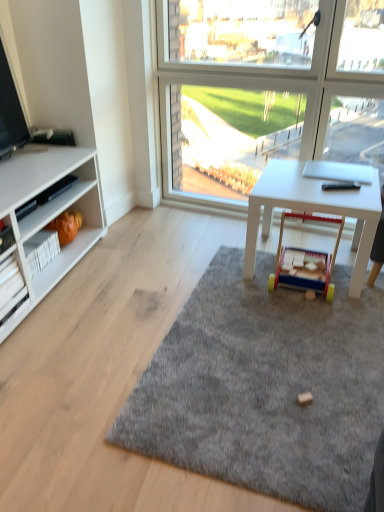
Question: From a real-world perspective, is orange fabric toy at lower left, the 1th toy viewed from the back, above or below white cardboard shelf at left?

Choices:
 (A) below
 (B) above

Answer: (A)

Question: Is orange fabric toy at lower left, the 1th toy viewed from the back, spatially inside white cardboard shelf at left, or outside of it?

Choices:
 (A) outside
 (B) inside

Answer: (A)

Question: Which object is positioned farthest from the white cardboard shelf at left?

Choices:
 (A) white matte desk at center
 (B) orange fabric toy at lower left, the 1th toy viewed from the back
 (C) wooden toy at center, acting as the second toy starting from the back
 (D) gray soft rug at center

Answer: (A)

Question: Estimate the real-world distances between objects in this image. Which object is closer to the orange fabric toy at lower left, the 2th toy in the right-to-left sequence?

Choices:
 (A) white matte desk at center
 (B) gray soft rug at center
 (C) wooden toy at center, which ranks as the first toy in front-to-back order
 (D) white cardboard shelf at left

Answer: (D)